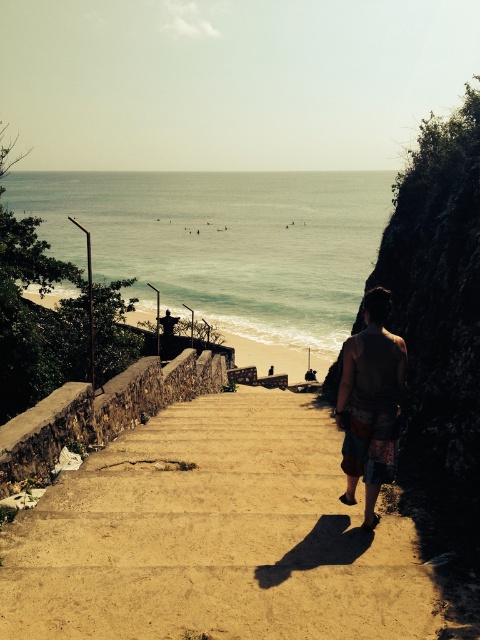
You are standing at the top of the brown concrete stairs at center. Which direction should you walk to reach the beach below?

Since the brown concrete stairs at center are positioned at point (214, 536), you should walk downward along the stairs to reach the beach below.

You are standing on the brown concrete stairs at center and want to place the brown fabric bag at center on the steps. Can you fit the bag on the stairs without it hanging over the edge?

The brown concrete stairs at center is not as tall as brown fabric bag at center, so the bag will hang over the edge since it is taller than the stairs.